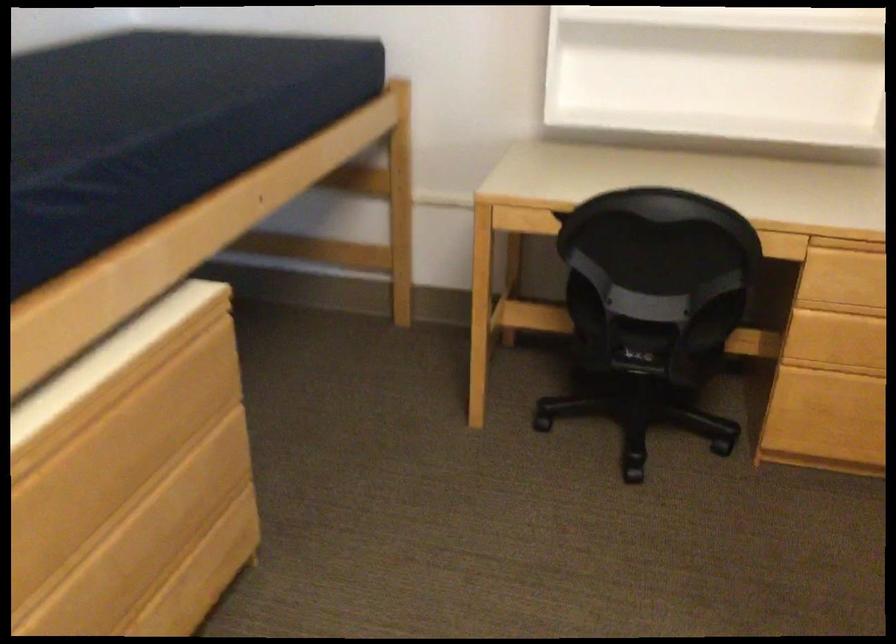
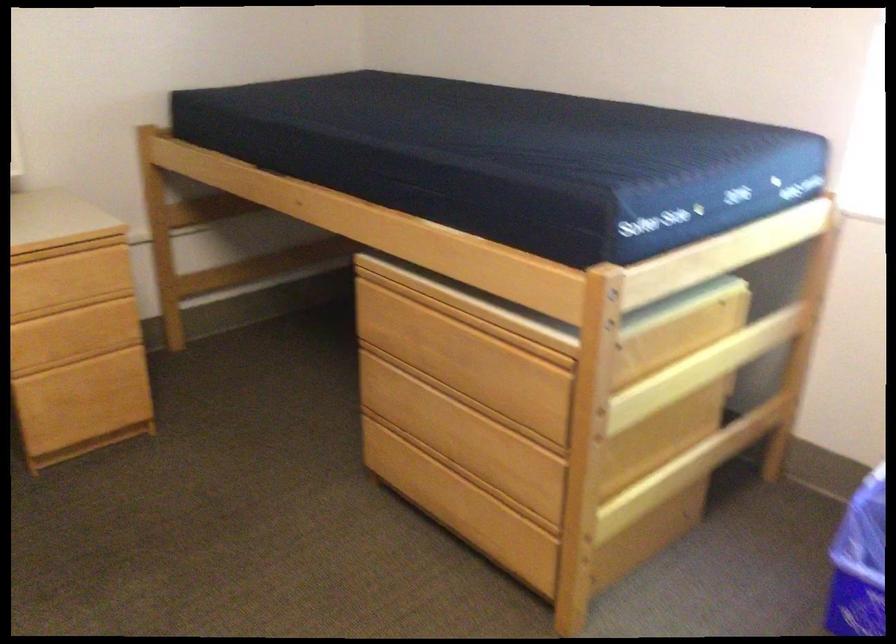
Question: Based on the continuous images, in which direction is the camera rotating? Reply with the corresponding letter.

Choices:
 (A) Left
 (B) Right
 (C) Up
 (D) Down

Answer: (B)